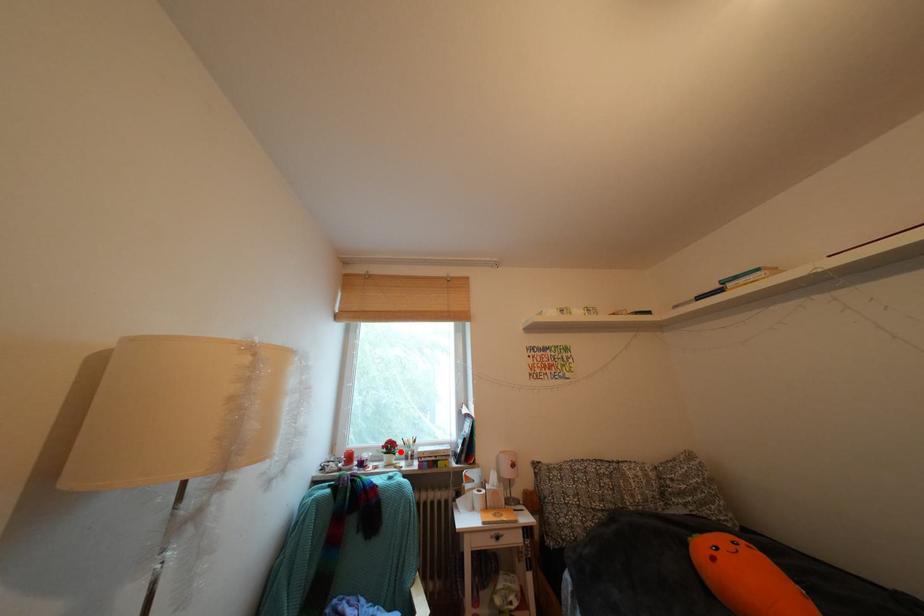
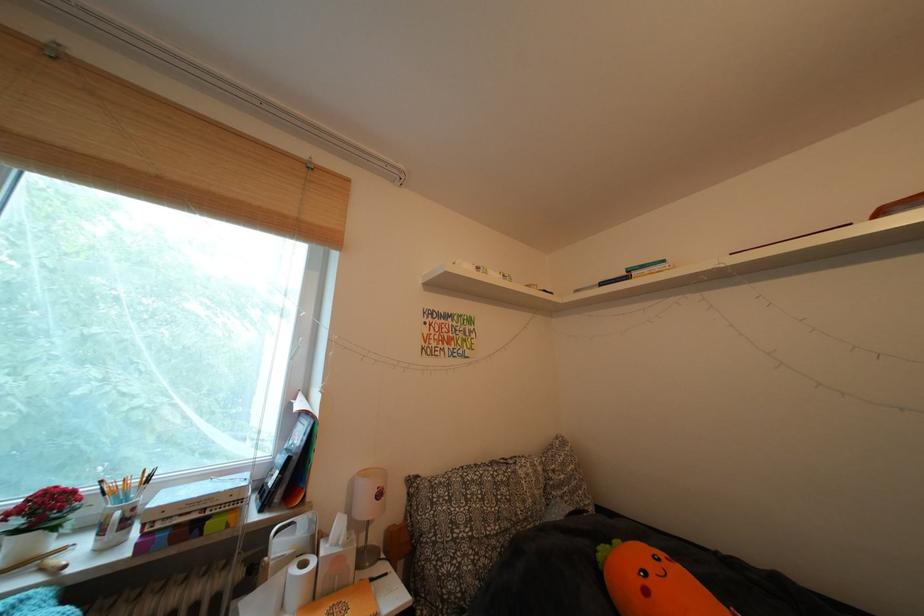
Question: I am providing you with two images of the same scene from different viewpoints. In image1, a red point is highlighted. Considering the same 3D point in image2, which of the following is correct?

Choices:
 (A) It is closer
 (B) It is farther

Answer: (A)